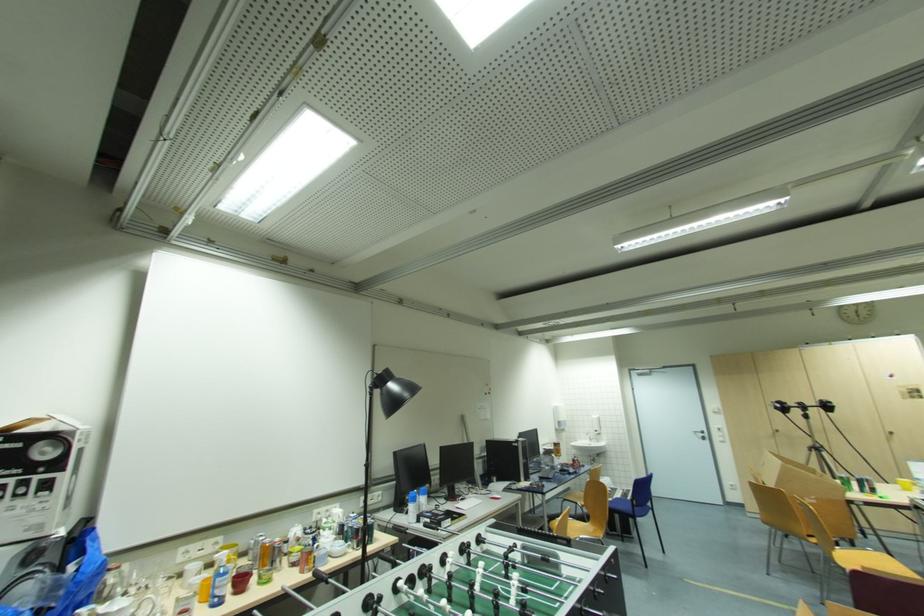
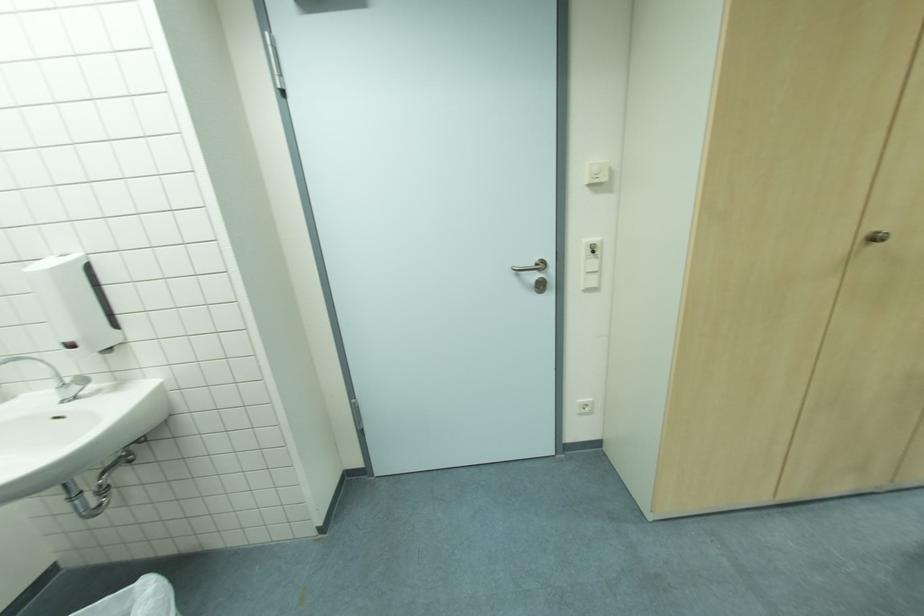
Locate, in the second image, the point that corresponds to pixel 724 440 in the first image.

(598, 285)